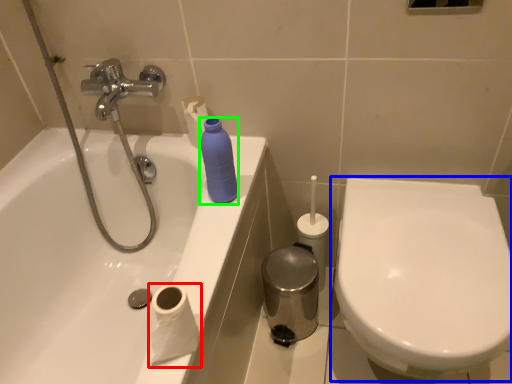
Question: Which object is positioned farthest from toilet paper (highlighted by a red box)? Select from toilet (highlighted by a blue box) and cleaning product (highlighted by a green box).

Choices:
 (A) toilet
 (B) cleaning product

Answer: (A)